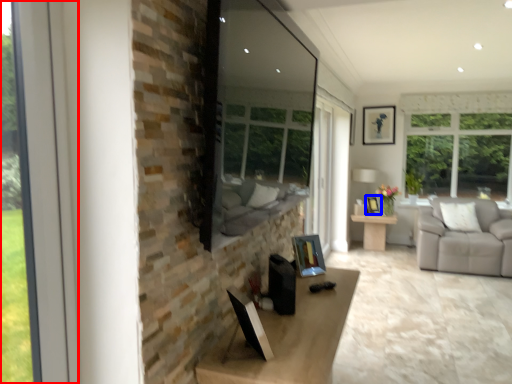
Question: Which point is further to the camera, window (highlighted by a red box) or picture frame (highlighted by a blue box)?

Choices:
 (A) window
 (B) picture frame

Answer: (B)